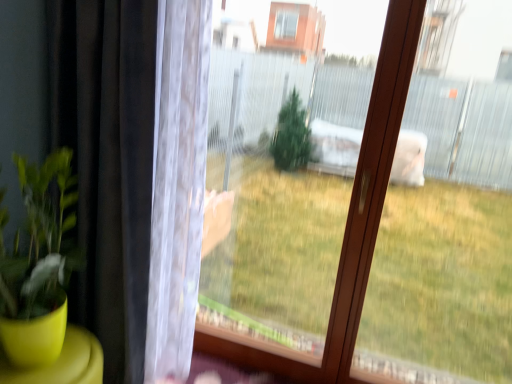
Question: Relative to transparent plastic screen at center, is black matte curtain at left in front or behind?

Choices:
 (A) behind
 (B) front

Answer: (B)

Question: From a real-world perspective, relative to transparent plastic screen at center, is black matte curtain at left vertically above or below?

Choices:
 (A) above
 (B) below

Answer: (B)

Question: Based on their sizes in the image, would you say black matte curtain at left is bigger or smaller than transparent plastic screen at center?

Choices:
 (A) small
 (B) big

Answer: (B)

Question: Based on their positions, is transparent plastic screen at center located to the left or right of black matte curtain at left?

Choices:
 (A) right
 (B) left

Answer: (A)

Question: Is transparent plastic screen at center in front of or behind black matte curtain at left in the image?

Choices:
 (A) behind
 (B) front

Answer: (A)

Question: Looking at the image, does transparent plastic screen at center seem bigger or smaller compared to black matte curtain at left?

Choices:
 (A) small
 (B) big

Answer: (A)

Question: Is transparent plastic screen at center wider or thinner than black matte curtain at left?

Choices:
 (A) thin
 (B) wide

Answer: (A)